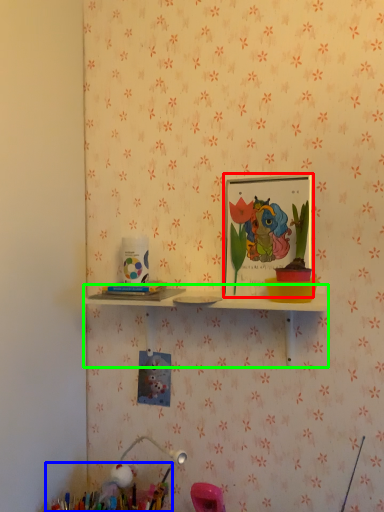
Question: Considering the real-world distances, which object is farthest from picture frame (highlighted by a red box)? collection (highlighted by a blue box) or shelf (highlighted by a green box)?

Choices:
 (A) collection
 (B) shelf

Answer: (A)